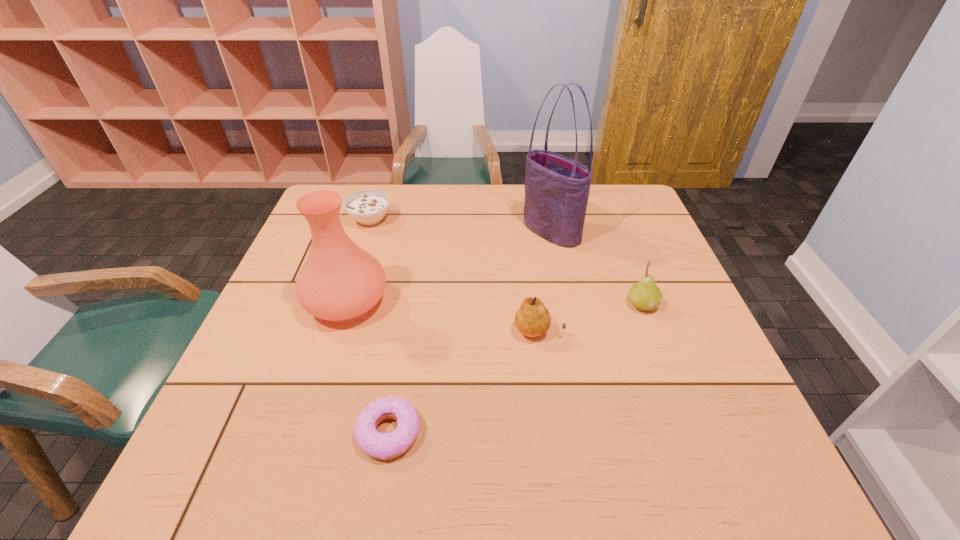
Where is `object at the right edge`? This screenshot has height=540, width=960. object at the right edge is located at coordinates (644, 295).

Identify the location of object that is at the far left corner. (368, 207).

Find the location of `vacant region at the far edge`. vacant region at the far edge is located at coordinates (480, 210).

Identify the location of vacant point at the near edge. This screenshot has height=540, width=960. (492, 474).

Image resolution: width=960 pixels, height=540 pixels. I want to click on vacant area at the left edge of the desktop, so click(x=270, y=335).

In the image, there is a desktop. Find the location of `vacant space at the right edge`. vacant space at the right edge is located at coordinates (680, 436).

The width and height of the screenshot is (960, 540). In order to click on vacant area that lies between the doughnut and the soup bowl in this screenshot , I will do [x=381, y=326].

You are a GUI agent. You are given a task and a screenshot of the screen. Output one action in this format:
    pyautogui.click(x=<x>, y=<y>)
    Task: Click on the free spot between the tallest object and the soup bowl
    The width and height of the screenshot is (960, 540).
    Given the screenshot: What is the action you would take?
    pyautogui.click(x=461, y=225)

At what (x,y) coordinates should I click in order to perform the action: click on vacant point located between the third shortest object and the shortest object. Please return your answer as a coordinate pair (x, y). The image size is (960, 540). Looking at the image, I should click on (465, 382).

I want to click on free area in between the nearest object and the fifth tallest object, so click(x=381, y=326).